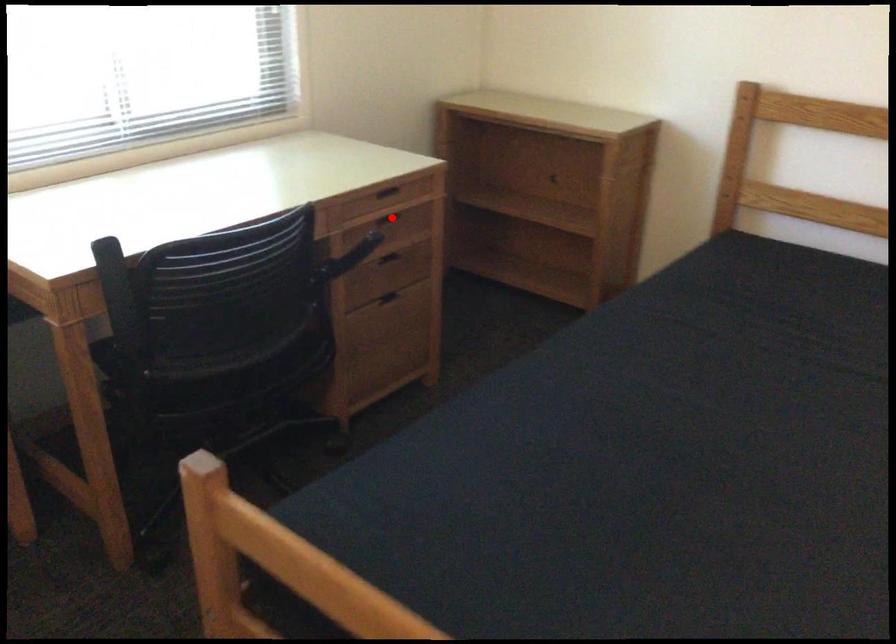
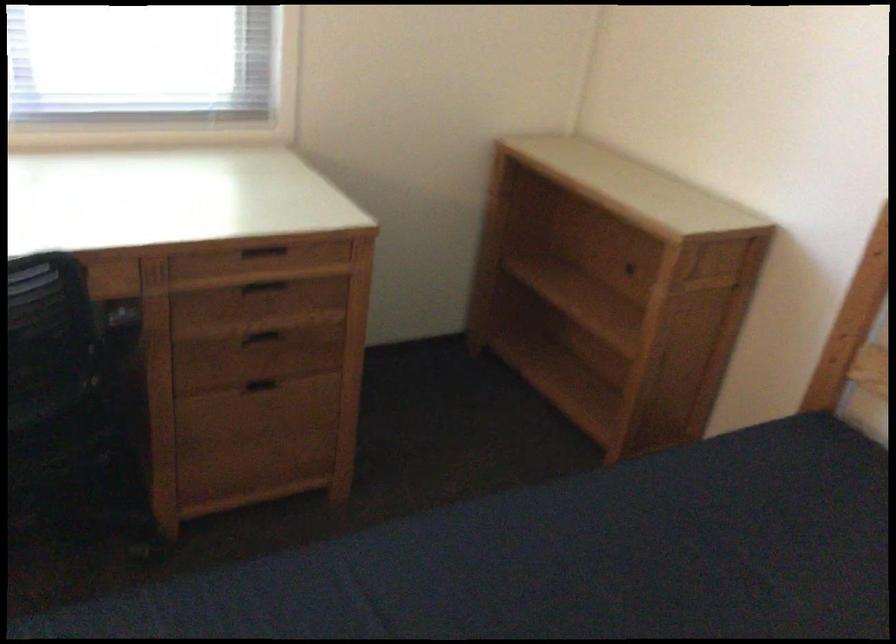
Find the pixel in the second image that matches the highlighted location in the first image.

(263, 285)